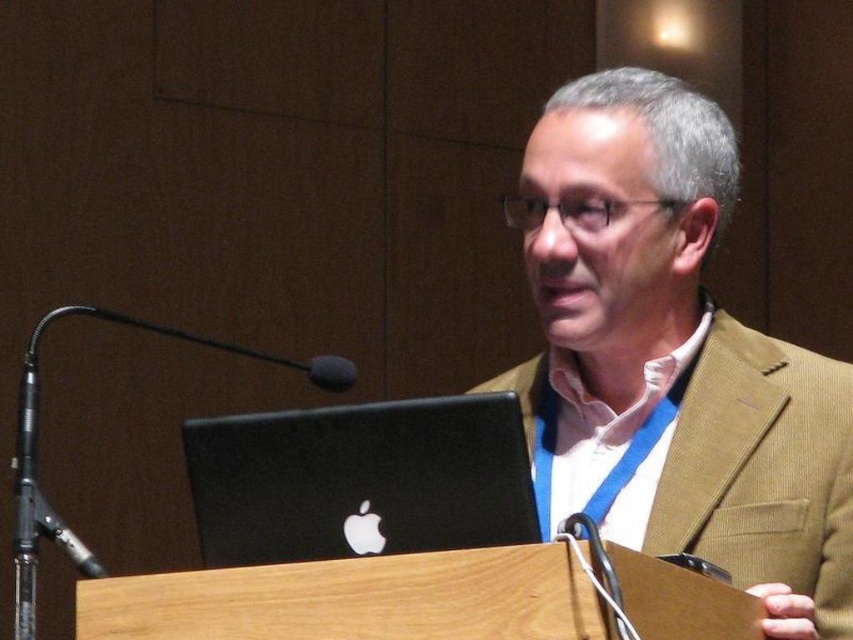
Question: Can you confirm if matte brown suit at center is bigger than black matte laptop at center?

Choices:
 (A) yes
 (B) no

Answer: (A)

Question: Which point is farther from the camera taking this photo?

Choices:
 (A) (711, 545)
 (B) (297, 476)

Answer: (A)

Question: Which of the following is the farthest from the observer?

Choices:
 (A) (670, 88)
 (B) (393, 481)

Answer: (A)

Question: Can you confirm if matte brown suit at center is wider than black matte laptop at center?

Choices:
 (A) no
 (B) yes

Answer: (B)

Question: Can you confirm if matte brown suit at center is thinner than black matte laptop at center?

Choices:
 (A) no
 (B) yes

Answer: (A)